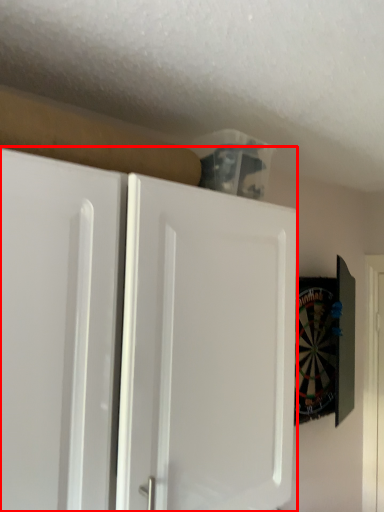
Question: Observing the image, what is the correct spatial positioning of cabinetry (annotated by the red box) in reference to door?

Choices:
 (A) right
 (B) left

Answer: (B)